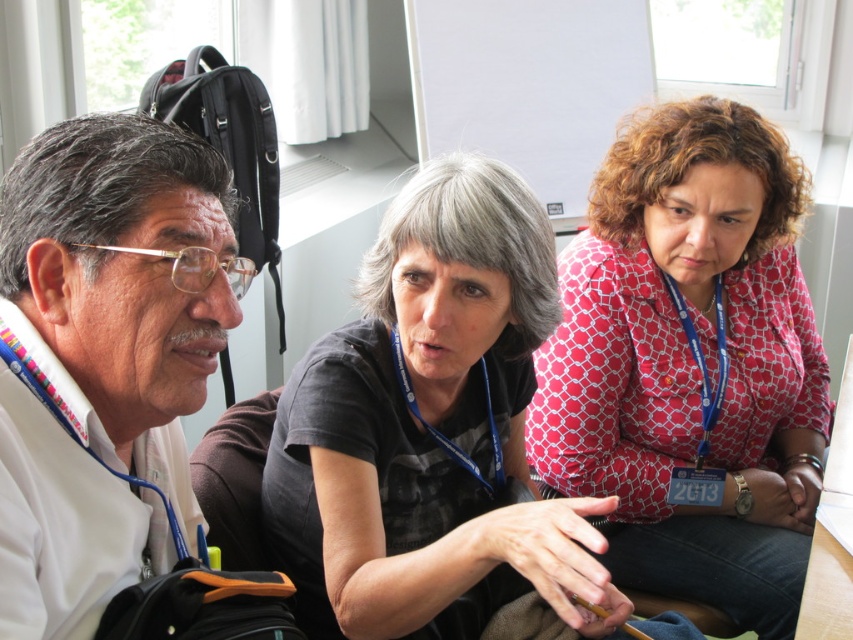
Question: Is red dotted blouse at center further to the viewer compared to white matte shirt at left?

Choices:
 (A) yes
 (B) no

Answer: (A)

Question: Is red dotted blouse at center thinner than black matte shirt at center?

Choices:
 (A) yes
 (B) no

Answer: (B)

Question: Which object is closer to the camera taking this photo?

Choices:
 (A) white matte shirt at left
 (B) red dotted blouse at center
 (C) black matte shirt at center

Answer: (A)

Question: Which object is closer to the camera taking this photo?

Choices:
 (A) red dotted blouse at center
 (B) white matte shirt at left
 (C) black matte shirt at center

Answer: (B)

Question: Which object is the farthest from the black matte shirt at center?

Choices:
 (A) white matte shirt at left
 (B) red dotted blouse at center

Answer: (B)

Question: Is black matte shirt at center to the left of white matte shirt at left from the viewer's perspective?

Choices:
 (A) no
 (B) yes

Answer: (A)